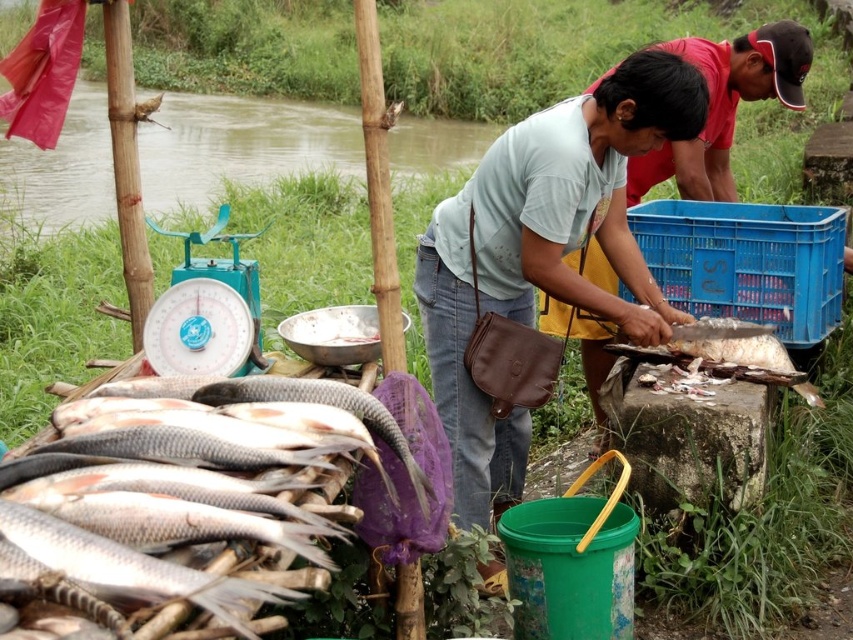
Question: Can you confirm if white matte fish at lower left is smaller than white glossy fish at lower left?

Choices:
 (A) yes
 (B) no

Answer: (B)

Question: Which object is farther from the camera taking this photo?

Choices:
 (A) teal metallic scale at center-left
 (B) white glossy fish at lower left
 (C) white matte fish at lower left

Answer: (A)

Question: Which point is farther to the camera?

Choices:
 (A) white glossy fish at lower left
 (B) teal metallic scale at center-left
 (C) white matte fish at lower left

Answer: (B)

Question: Observing the image, what is the correct spatial positioning of white matte fish at lower left in reference to white glossy fish at lower left?

Choices:
 (A) below
 (B) above

Answer: (B)

Question: Where is white matte fish at lower left located in relation to white glossy fish at lower left in the image?

Choices:
 (A) left
 (B) right

Answer: (A)

Question: Which point is closer to the camera?

Choices:
 (A) white glossy fish at lower left
 (B) teal metallic scale at center-left
 (C) white matte fish at lower left

Answer: (C)